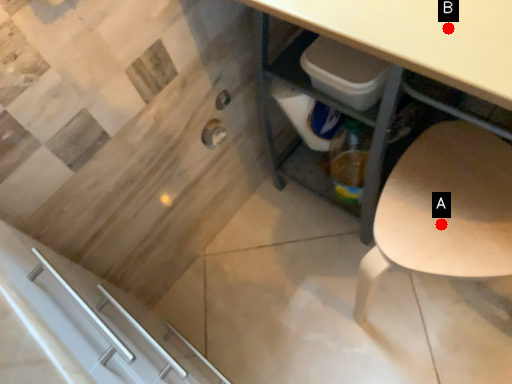
Question: Two points are circled on the image, labeled by A and B beside each circle. Which point appears closest to the camera in this image?

Choices:
 (A) A is closer
 (B) B is closer

Answer: (B)